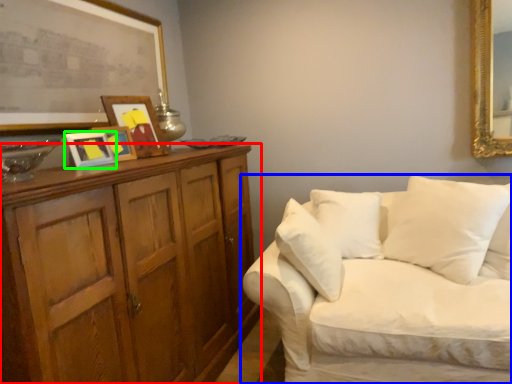
Question: Which object is positioned farthest from cabinetry (highlighted by a red box)? Select from studio couch (highlighted by a blue box) and picture frame (highlighted by a green box).

Choices:
 (A) studio couch
 (B) picture frame

Answer: (A)